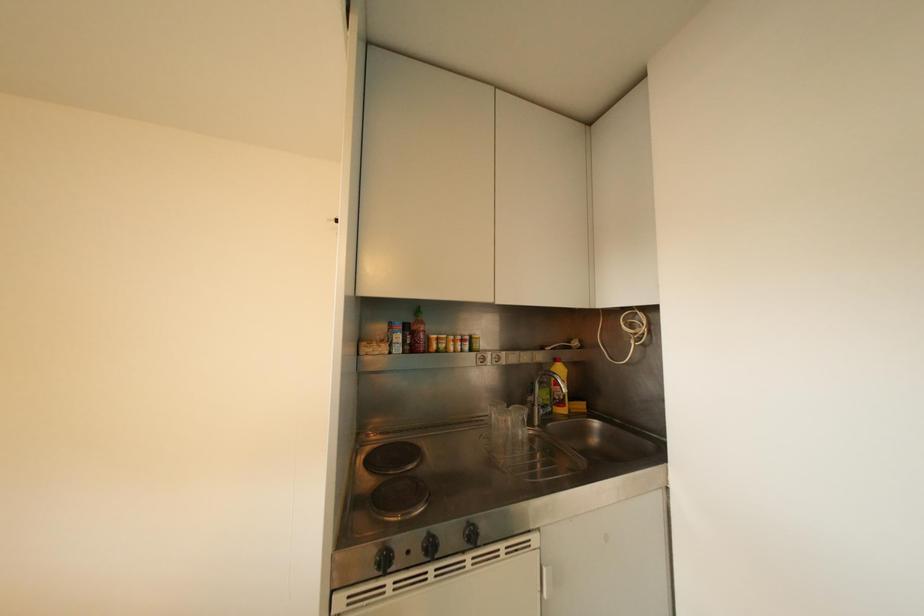
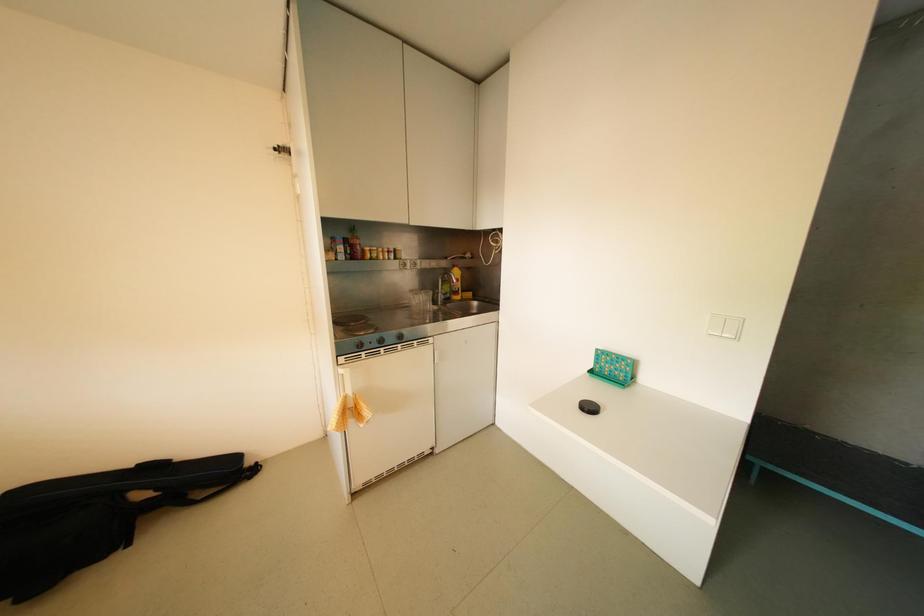
Question: Which direction would the cameraman need to move to produce the second image? Reply with the corresponding letter.

Choices:
 (A) Left
 (B) Right
 (C) Forward
 (D) Backward

Answer: (D)